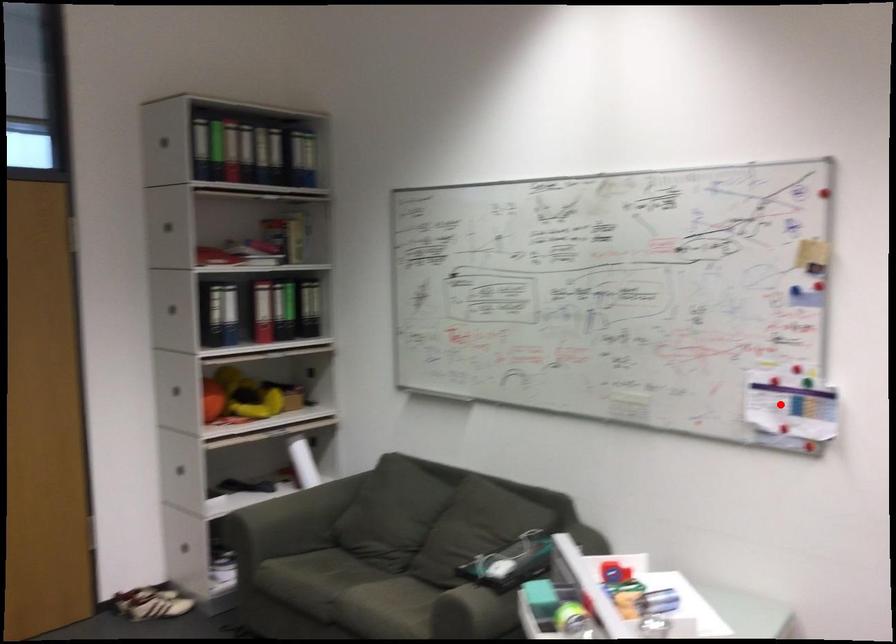
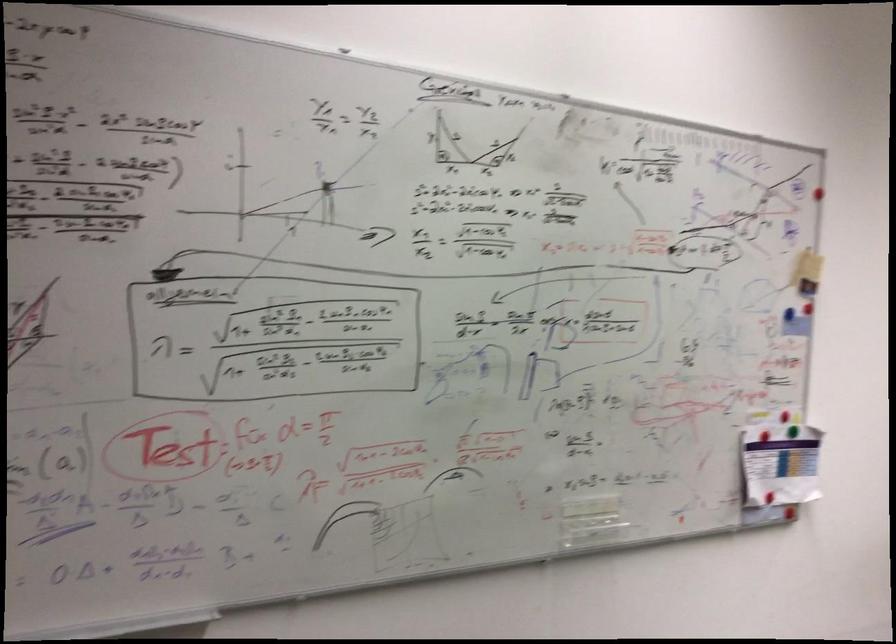
Question: I am providing you with two images of the same scene from different viewpoints. Image1 has a red point marked. In image2, the corresponding 3D location appears at what relative position? Reply with the corresponding letter.

Choices:
 (A) Closer
 (B) Farther

Answer: (A)